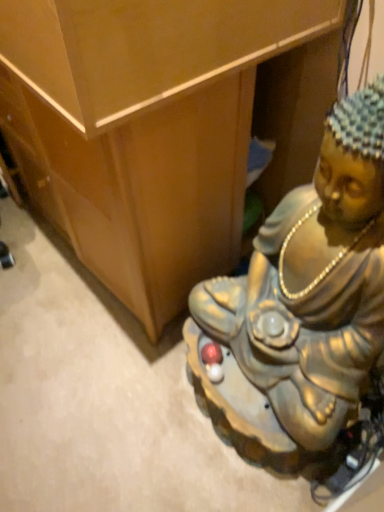
Question: Considering the relative sizes of metallic gold statue at lower right and metallic statue at lower right in the image provided, is metallic gold statue at lower right wider than metallic statue at lower right?

Choices:
 (A) no
 (B) yes

Answer: (A)

Question: Is the position of metallic gold statue at lower right less distant than that of metallic statue at lower right?

Choices:
 (A) no
 (B) yes

Answer: (B)

Question: Is metallic gold statue at lower right behind metallic statue at lower right?

Choices:
 (A) no
 (B) yes

Answer: (A)

Question: Does metallic gold statue at lower right have a lesser width compared to metallic statue at lower right?

Choices:
 (A) no
 (B) yes

Answer: (B)

Question: Is metallic gold statue at lower right oriented away from metallic statue at lower right?

Choices:
 (A) yes
 (B) no

Answer: (B)

Question: From the image's perspective, is metallic gold statue at lower right under metallic statue at lower right?

Choices:
 (A) yes
 (B) no

Answer: (A)

Question: Is metallic statue at lower right to the left of metallic gold statue at lower right from the viewer's perspective?

Choices:
 (A) yes
 (B) no

Answer: (A)

Question: Is metallic statue at lower right oriented away from metallic gold statue at lower right?

Choices:
 (A) no
 (B) yes

Answer: (A)

Question: Can you confirm if metallic statue at lower right is bigger than metallic gold statue at lower right?

Choices:
 (A) yes
 (B) no

Answer: (B)

Question: From the image's perspective, is metallic statue at lower right located beneath metallic gold statue at lower right?

Choices:
 (A) no
 (B) yes

Answer: (A)

Question: Is metallic statue at lower right next to metallic gold statue at lower right and touching it?

Choices:
 (A) yes
 (B) no

Answer: (B)

Question: Does metallic statue at lower right have a greater height compared to metallic gold statue at lower right?

Choices:
 (A) yes
 (B) no

Answer: (B)

Question: Relative to metallic gold statue at lower right, is metallic statue at lower right in front or behind?

Choices:
 (A) front
 (B) behind

Answer: (B)